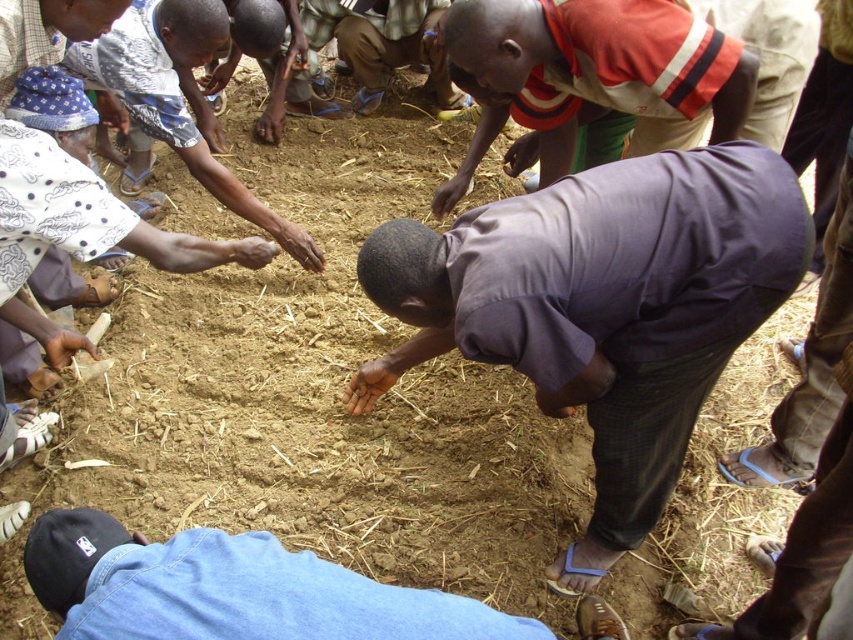
Which is more to the right, purple cotton shirt at center or red and white striped shirt at center?

From the viewer's perspective, red and white striped shirt at center appears more on the right side.

Which of these two, purple cotton shirt at center or red and white striped shirt at center, stands shorter?

Standing shorter between the two is red and white striped shirt at center.

Does point (726, 266) lie behind point (480, 115)?

No, (726, 266) is closer to viewer.

This screenshot has height=640, width=853. I want to click on purple cotton shirt at center, so click(x=602, y=308).

Does blue denim jeans at lower center have a greater width compared to red and white striped shirt at center?

Yes, blue denim jeans at lower center is wider than red and white striped shirt at center.

What do you see at coordinates (230, 589) in the screenshot? I see `blue denim jeans at lower center` at bounding box center [230, 589].

Identify the location of blue denim jeans at lower center. The height and width of the screenshot is (640, 853). (230, 589).

Can you confirm if purple cotton shirt at center is wider than blue denim jeans at lower center?

Yes.

Which is behind, point (579, 323) or point (195, 566)?

The point (579, 323) is behind.

Is point (622, 548) positioned after point (115, 628)?

Yes, it is behind point (115, 628).

Locate an element on the screen. purple cotton shirt at center is located at coordinates (602, 308).